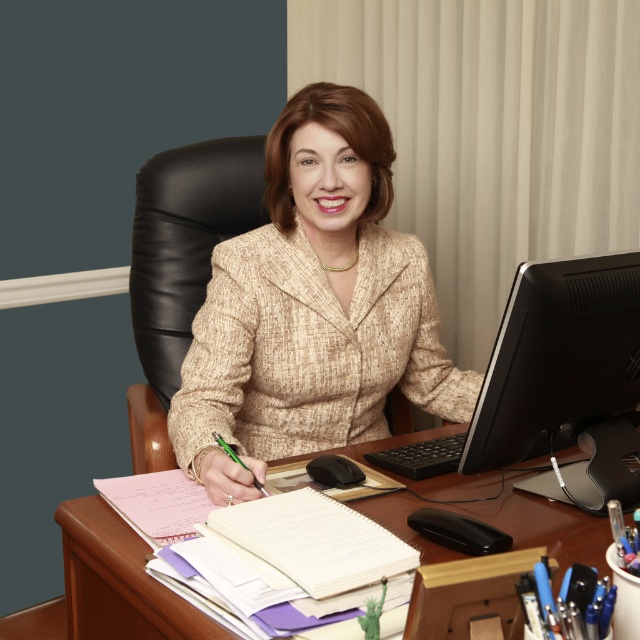
Does beige textured suit at center have a smaller size compared to white paper notebook at center?

Actually, beige textured suit at center might be larger than white paper notebook at center.

Is point (326, 177) more distant than point (376, 572)?

Yes, point (326, 177) is behind point (376, 572).

Where is `beige textured suit at center`? beige textured suit at center is located at coordinates (312, 307).

Does beige textured suit at center have a lesser height compared to black matte computer monitor at right?

No, beige textured suit at center is not shorter than black matte computer monitor at right.

From the picture: How distant is beige textured suit at center from black matte computer monitor at right?

beige textured suit at center is 47.49 centimeters from black matte computer monitor at right.

Describe the element at coordinates (312, 307) in the screenshot. I see `beige textured suit at center` at that location.

The height and width of the screenshot is (640, 640). I want to click on beige textured suit at center, so click(x=312, y=307).

The width and height of the screenshot is (640, 640). What do you see at coordinates (116, 580) in the screenshot?
I see `wooden at center` at bounding box center [116, 580].

Does wooden at center have a greater height compared to white paper notebook at center?

A: Yes.

Which is behind, point (401, 522) or point (257, 536)?

The point (401, 522) is more distant.

Where is `wooden at center`? The height and width of the screenshot is (640, 640). wooden at center is located at coordinates (116, 580).